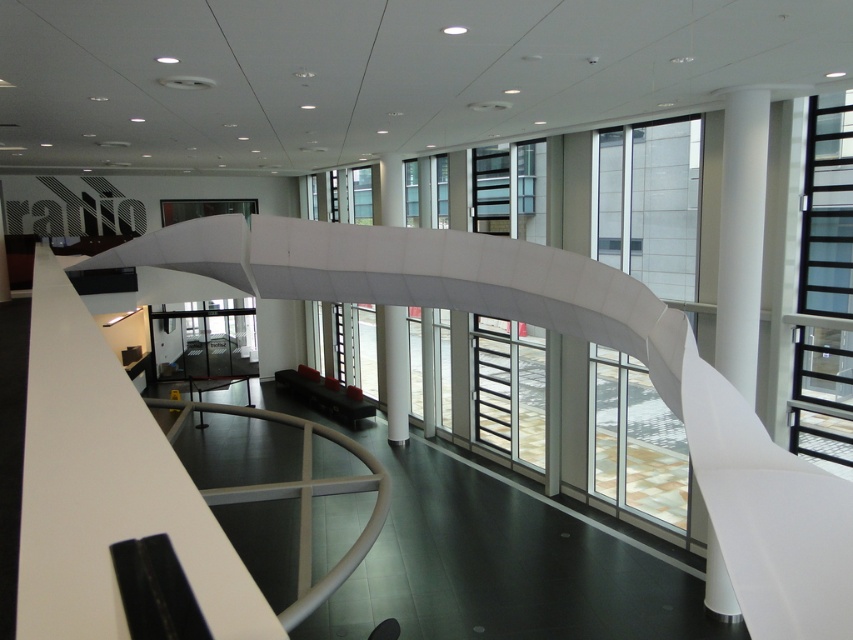
You are an interior designer assessing the space. You need to install a light fixture that requires a minimum height of 2.5 meters. Based on the image, which object between the white smooth column at right and the white glossy pillar at center would be suitable for mounting the fixture?

The white smooth column at right is taller than the white glossy pillar at center, so it would be suitable for mounting the light fixture requiring a minimum height of 2.5 meters.

You are an architect designing a new exhibition space in this building. You need to place a sculpture that requires a 9 meter clearance between two supporting structures. Can the white smooth column at right and the white glossy pillar at center provide sufficient space for this sculpture?

The distance between the white smooth column at right and the white glossy pillar at center is 8.96 meters, which is slightly less than the required 9 meters. Therefore, the space between them is insufficient for the sculpture requiring 9 meter clearance.

You are standing at the entrance of the modern building and want to locate the white smooth column at right. According to the coordinates provided, where would you find it in the image?

The white smooth column at right is located at coordinates point (741, 237) in the image.